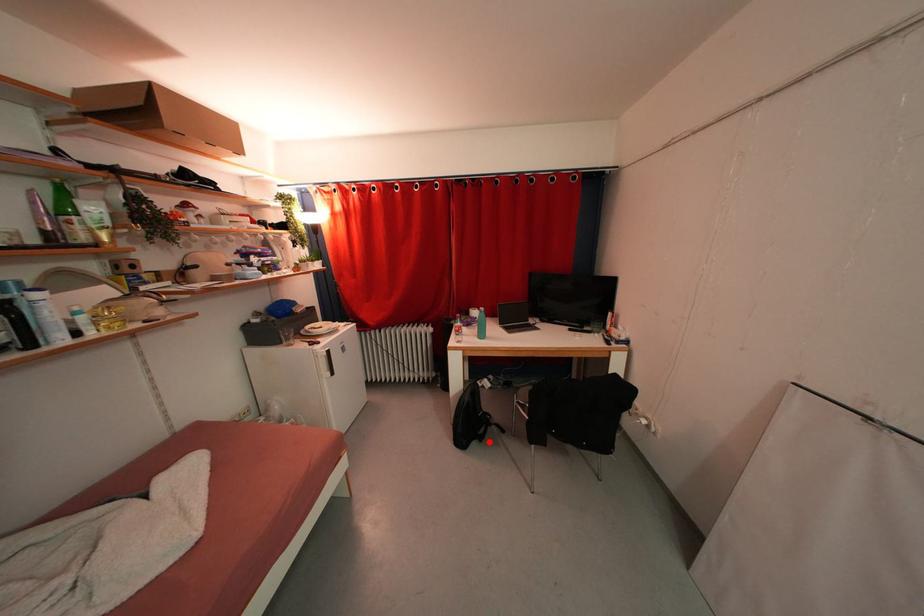
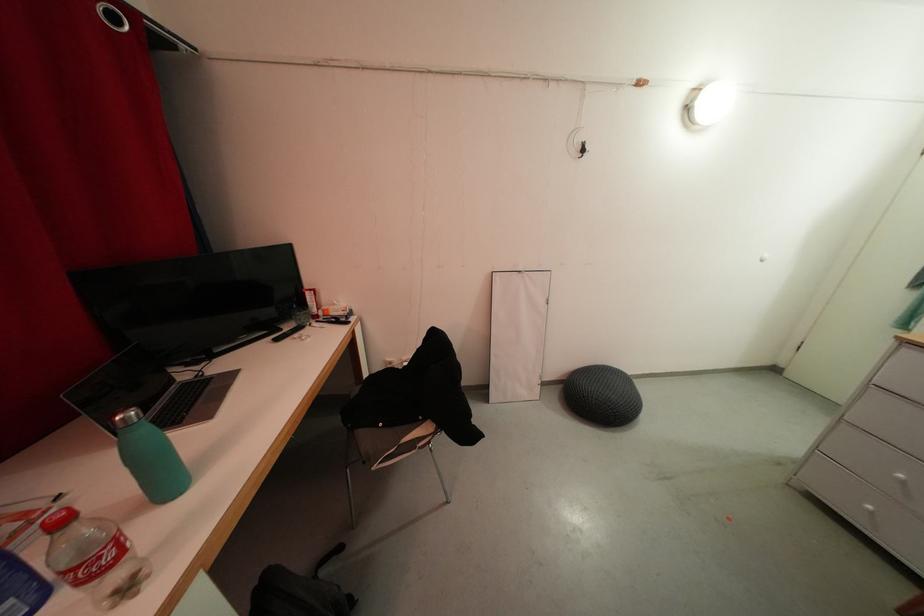
The point at the highlighted location is marked in the first image. Where is the corresponding point in the second image?

(357, 601)